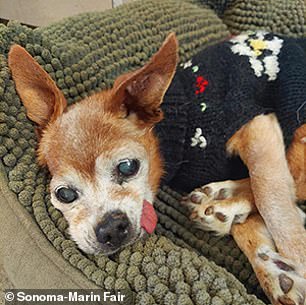
Find the location of a particular element. The image size is (306, 305). green nubby cushion fabric is located at coordinates (178, 278).